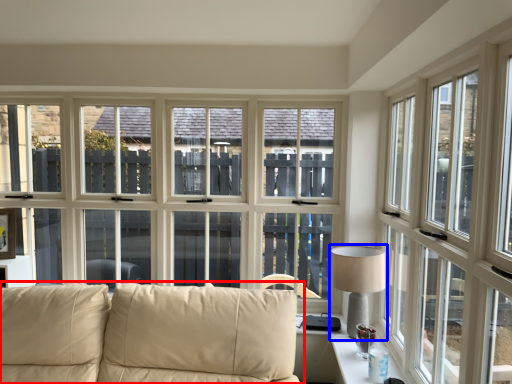
Question: Which of the following is the farthest to the observer, studio couch (highlighted by a red box) or table lamp (highlighted by a blue box)?

Choices:
 (A) studio couch
 (B) table lamp

Answer: (B)